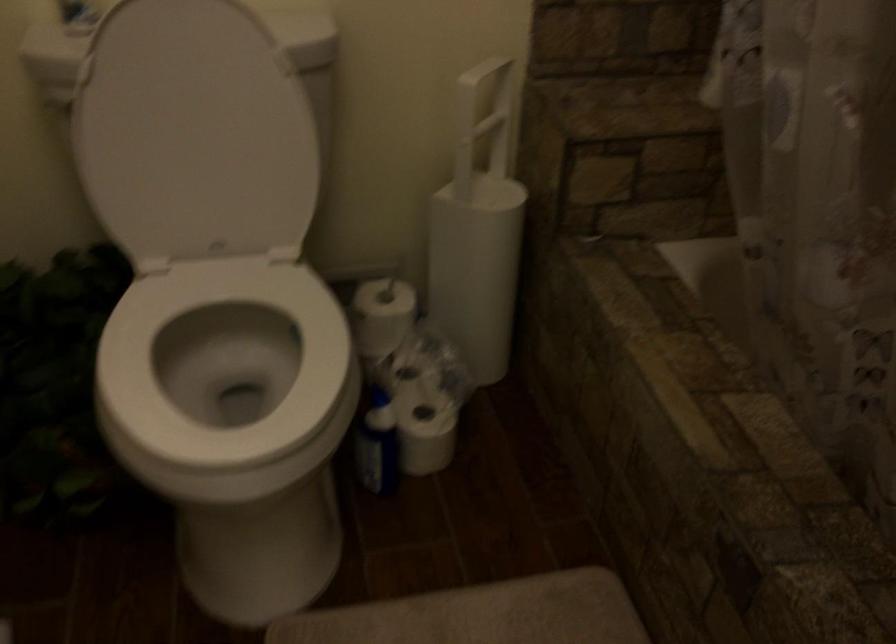
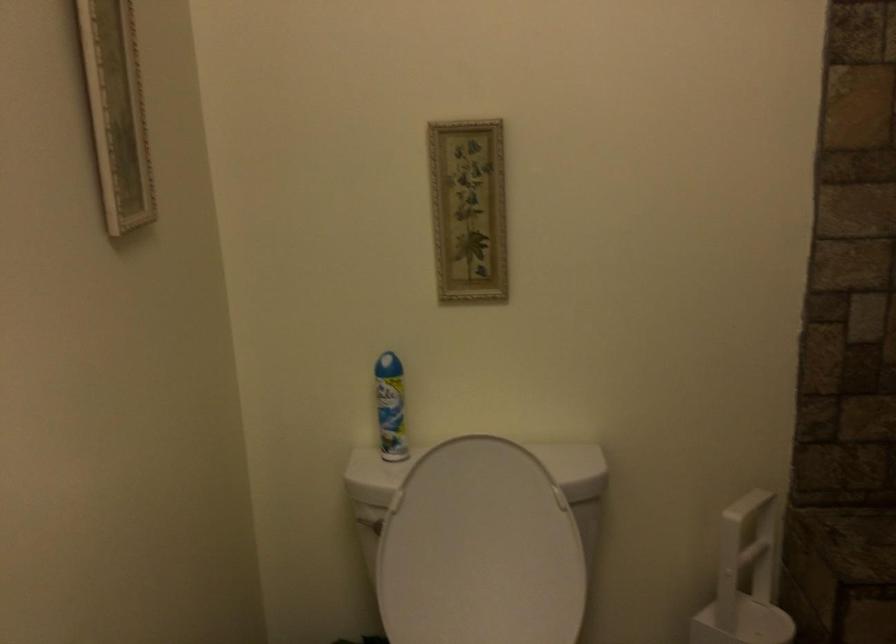
Find the pixel in the second image that matches (74,102) in the first image.

(368, 522)